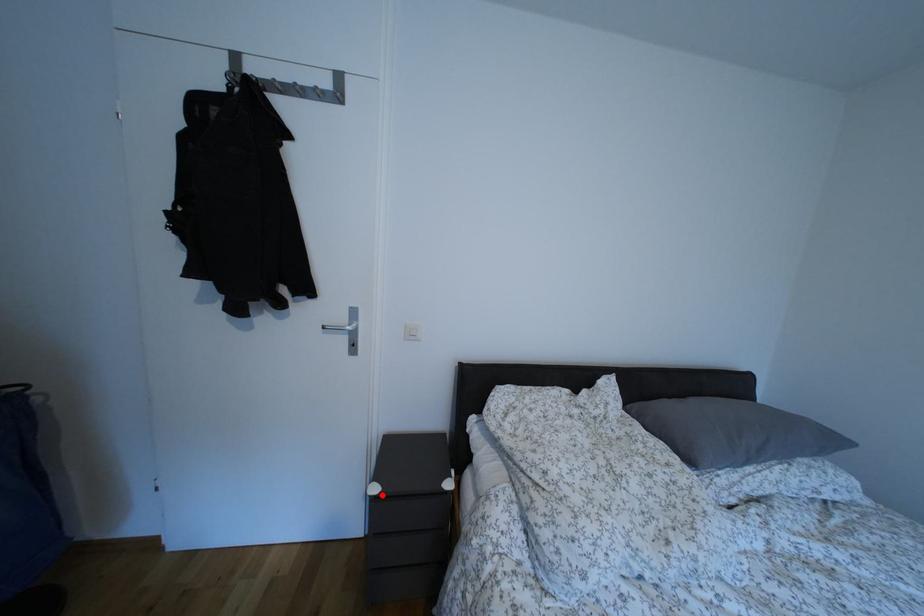
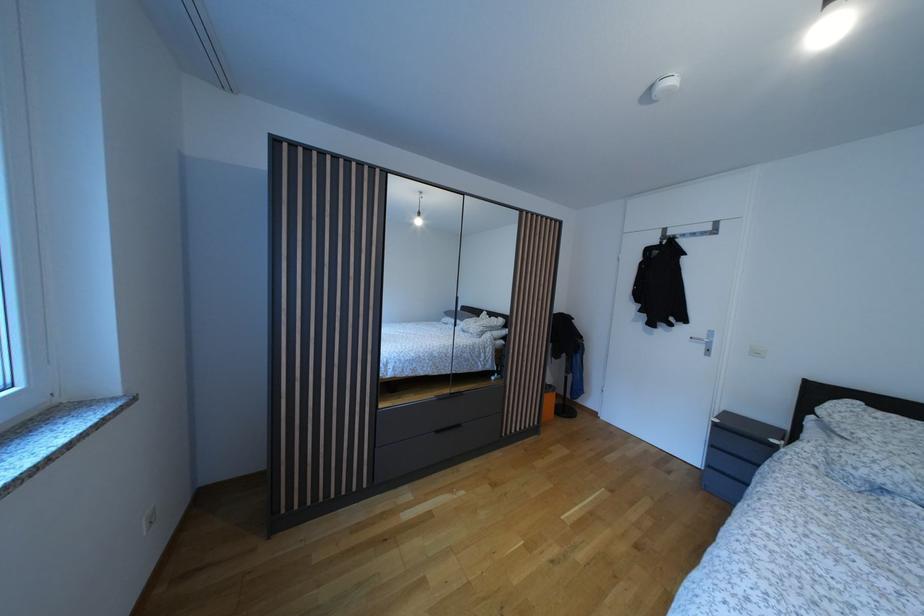
Where in the second image is the point corresponding to the highlighted location from the first image?

(723, 427)